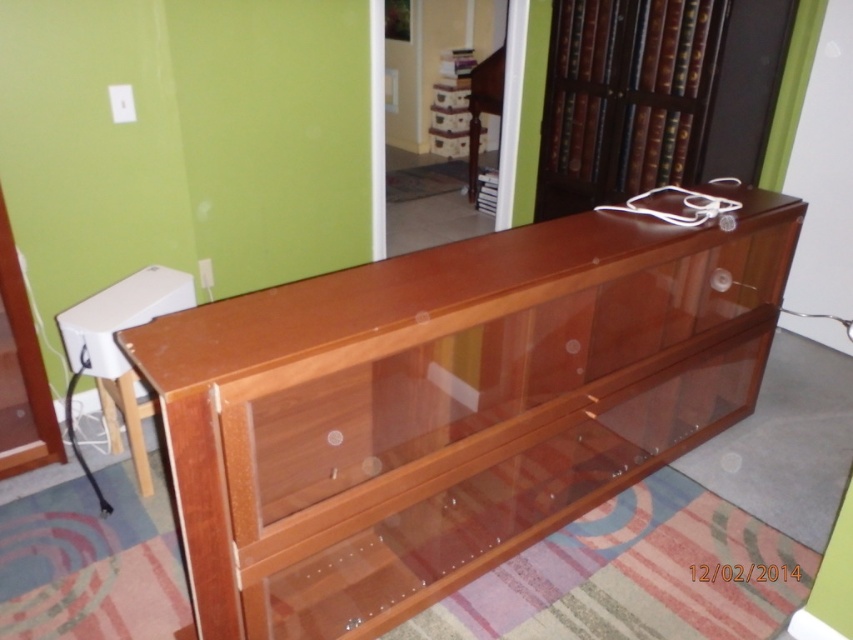
Does glossy wood dresser at center lie in front of brown wooden bookshelf at upper right?

Yes, it is.

Does point (566, 481) come in front of point (688, 157)?

Yes, it is in front of point (688, 157).

The height and width of the screenshot is (640, 853). Find the location of `glossy wood dresser at center`. glossy wood dresser at center is located at coordinates (450, 404).